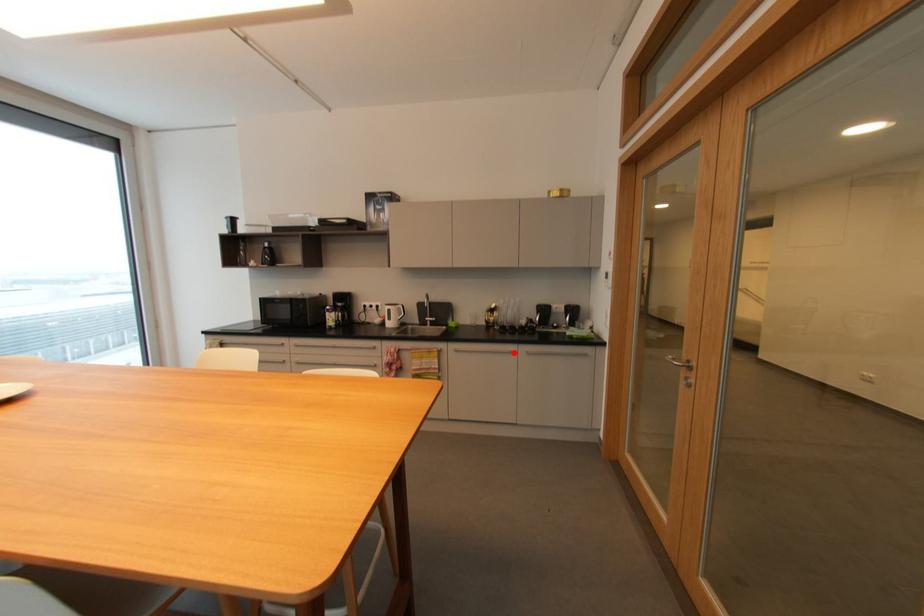
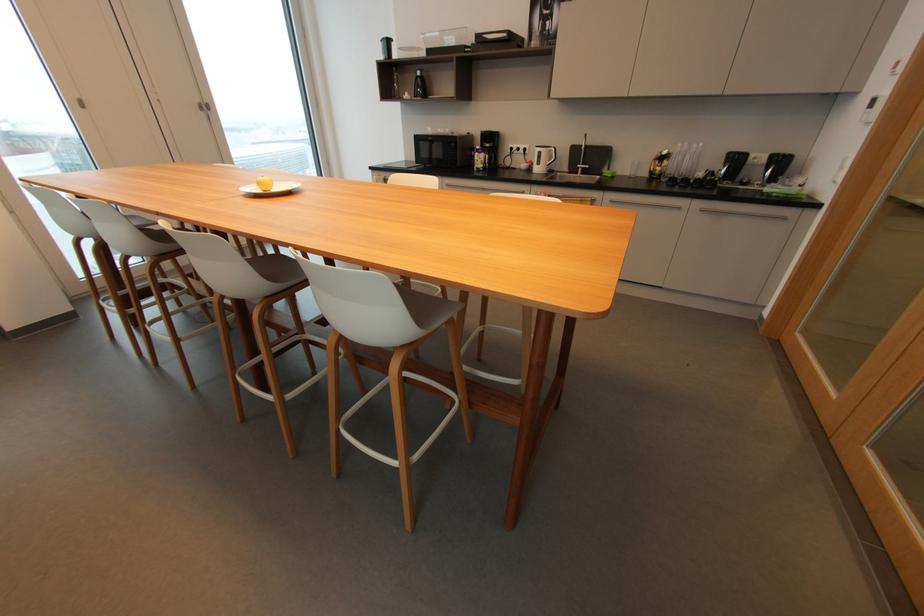
Locate, in the second image, the point that corresponds to the highlighted location in the first image.

(683, 208)